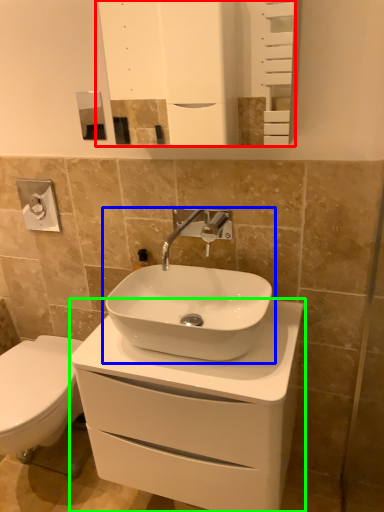
Question: Estimate the real-world distances between objects in this image. Which object is closer to mirror (highlighted by a red box), sink (highlighted by a blue box) or bathroom cabinet (highlighted by a green box)?

Choices:
 (A) sink
 (B) bathroom cabinet

Answer: (A)